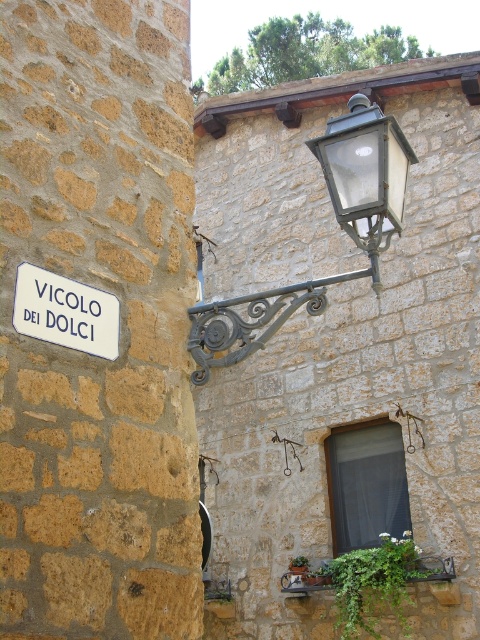
Which is in front, point (343, 145) or point (38, 317)?

Point (38, 317) is more forward.

In the scene shown: Is matte black lantern at upper center taller than white matte street sign at lower left?

Yes, matte black lantern at upper center is taller than white matte street sign at lower left.

The image size is (480, 640). I want to click on matte black lantern at upper center, so click(337, 221).

Is matte black lantern at upper center to the left of matte glass streetlight at upper right from the viewer's perspective?

Correct, you'll find matte black lantern at upper center to the left of matte glass streetlight at upper right.

Can you confirm if matte black lantern at upper center is shorter than matte glass streetlight at upper right?

No.

Who is more forward, (212,305) or (315,148)?

Point (315,148) is more forward.

Locate an element on the screen. matte black lantern at upper center is located at coordinates (337, 221).

Locate an element on the screen. This screenshot has width=480, height=640. matte glass streetlight at upper right is located at coordinates (364, 177).

Between point (356, 141) and point (38, 310), which one is positioned behind?

Point (356, 141)

Between point (345, 192) and point (83, 342), which one is positioned behind?

Positioned behind is point (345, 192).

You are a GUI agent. You are given a task and a screenshot of the screen. Output one action in this format:
    pyautogui.click(x=<x>, y=<y>)
    Task: Click on the matte glass streetlight at upper right
    
    Given the screenshot: What is the action you would take?
    pyautogui.click(x=364, y=177)